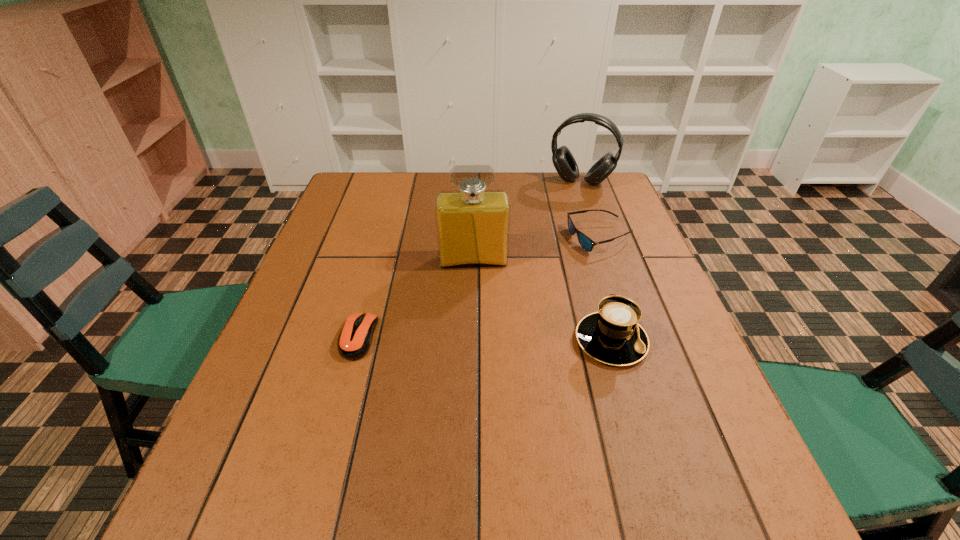
Where is `computer mouse`? The image size is (960, 540). computer mouse is located at coordinates (355, 339).

The height and width of the screenshot is (540, 960). In order to click on the shortest object in this screenshot , I will do `click(355, 339)`.

Locate an element on the screen. cappuccino is located at coordinates (612, 335).

This screenshot has height=540, width=960. In order to click on the second object from left to right in this screenshot , I will do `click(473, 224)`.

Where is `sunglasses`? This screenshot has width=960, height=540. sunglasses is located at coordinates (586, 243).

Identify the location of the second tallest object. The image size is (960, 540). (563, 160).

The height and width of the screenshot is (540, 960). In order to click on the farthest object in this screenshot , I will do (563, 160).

Locate an element on the screen. The image size is (960, 540). vacant space located on the front of the shortest object is located at coordinates (343, 395).

Identify the location of free location located on the back of the third shortest object. (585, 248).

Locate an element on the screen. This screenshot has height=540, width=960. vacant region located 0.240m on the front-facing side of the second object from left to right is located at coordinates (478, 343).